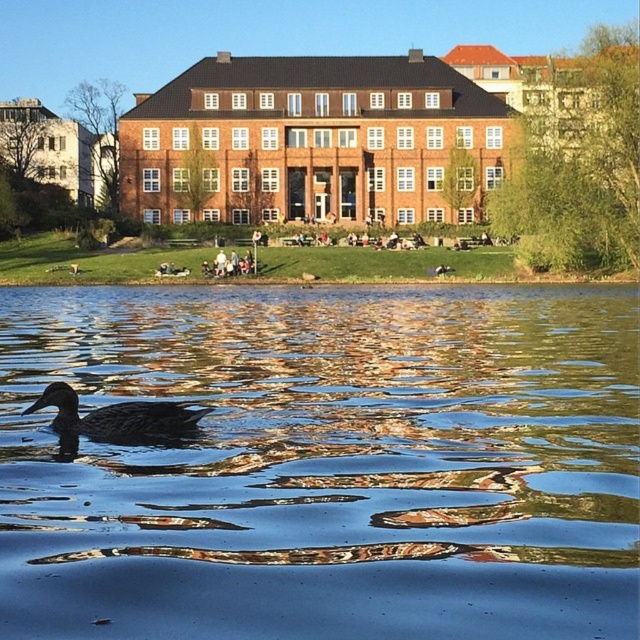
You are a photographer trying to capture the shiny blue water at center and the brown matte duck at lower left in a single shot. Based on their positions, which object will appear closer to the camera in the photo?

The shiny blue water at center appears closer to the camera than the brown matte duck at lower left because it is positioned in front of it.

You are standing in the park and want to take a photo of the shiny blue water at center. According to the scene description, where should you position yourself to capture the water in the center of your camera frame?

The shiny blue water at center is located at point (x=324, y=465), so you should position yourself at that coordinate to center it in your camera frame.

You are standing in the park and want to walk from point (595, 305) to point (147, 417). Which direction should you head?

Since point (595, 305) is closer to you than point (147, 417), you should move away from your current position towards the direction of the latter point.